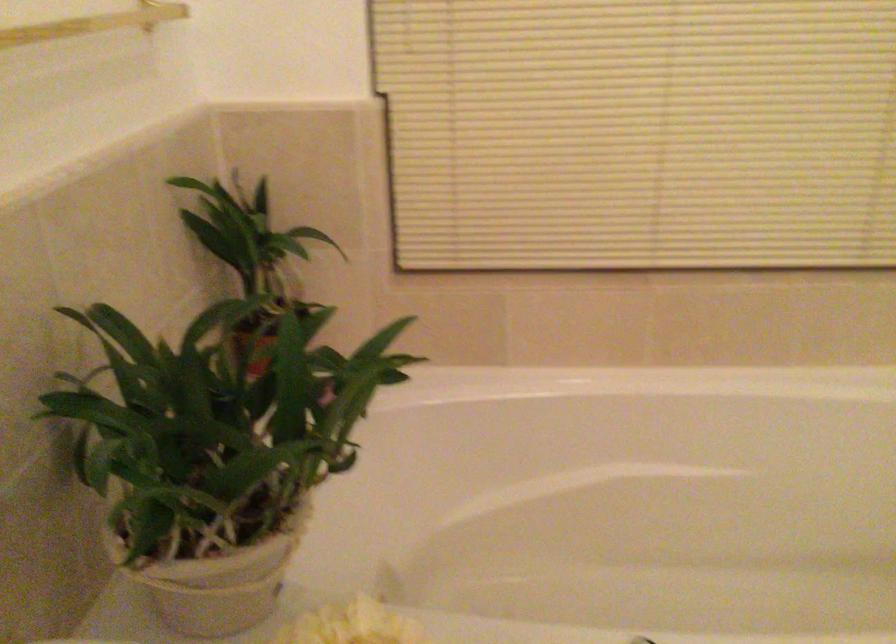
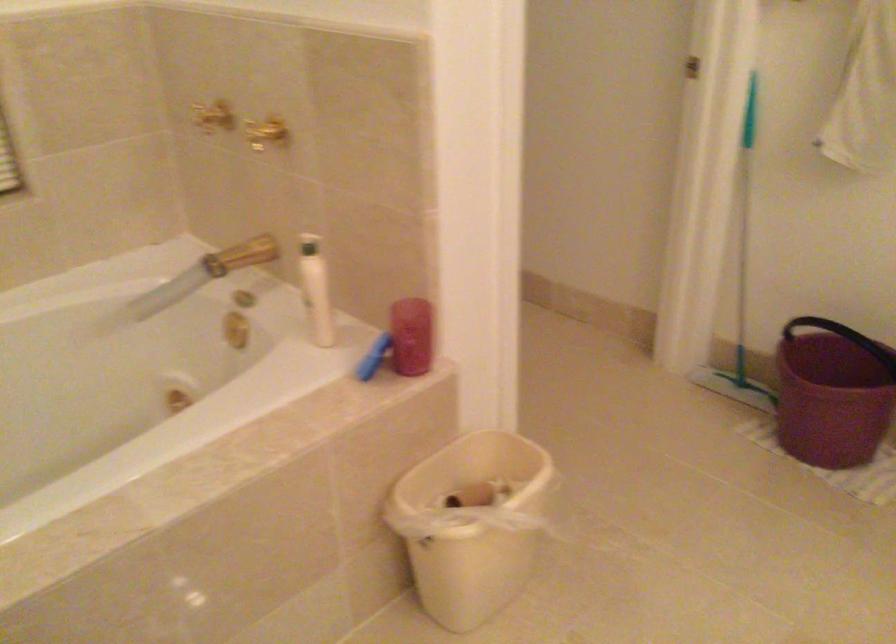
Question: How did the camera likely rotate?

Choices:
 (A) Left
 (B) Right
 (C) Up
 (D) Down

Answer: (B)